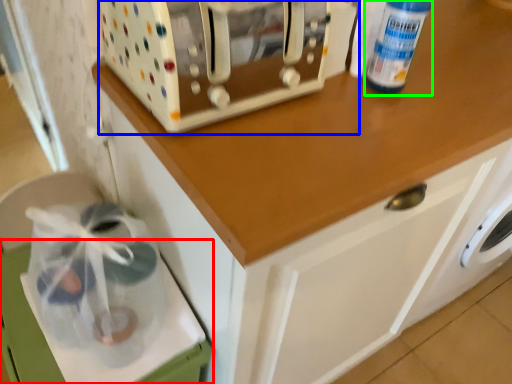
Question: Based on their relative distances, which object is farther from cabinetry (highlighted by a red box)? Choose from home appliance (highlighted by a blue box) and bottle (highlighted by a green box).

Choices:
 (A) home appliance
 (B) bottle

Answer: (B)